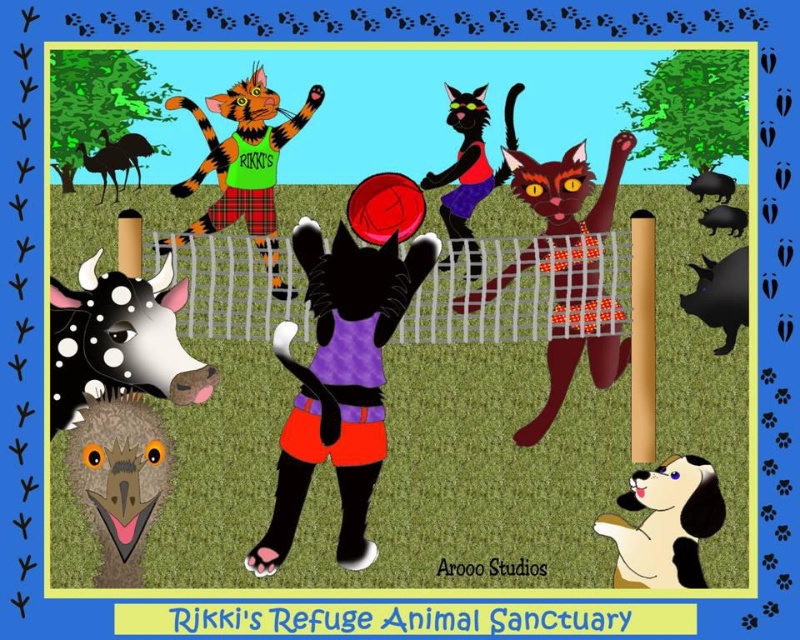
Between brown fuzzy head at lower left and black glossy pig at upper right, which one is positioned lower?

brown fuzzy head at lower left is below.

Does brown fuzzy head at lower left come behind black glossy pig at upper right?

No, it is not.

Which is behind, point (108, 428) or point (696, 193)?

The point (696, 193) is behind.

Where is `brown fuzzy head at lower left`? This screenshot has height=640, width=800. brown fuzzy head at lower left is located at coordinates (118, 480).

Who is positioned more to the right, purple fabric cat at center or black dotted cow at lower left?

purple fabric cat at center

Consider the image. Can you confirm if purple fabric cat at center is bigger than black dotted cow at lower left?

Yes, purple fabric cat at center is bigger than black dotted cow at lower left.

Which is behind, point (356, 445) or point (70, 328)?

Positioned behind is point (356, 445).

You are a GUI agent. You are given a task and a screenshot of the screen. Output one action in this format:
    pyautogui.click(x=<x>, y=<y>)
    Task: Click on the purple fabric cat at center
    The height and width of the screenshot is (640, 800).
    Given the screenshot: What is the action you would take?
    pyautogui.click(x=341, y=384)

Is black spiky hedgehog at lower right positioned behind black rubber pig at right?

No, it is not.

Based on the photo, can you confirm if black spiky hedgehog at lower right is smaller than black rubber pig at right?

Incorrect, black spiky hedgehog at lower right is not smaller in size than black rubber pig at right.

Is point (713, 305) more distant than point (702, 221)?

Yes, point (713, 305) is behind point (702, 221).

Identify the location of black spiky hedgehog at lower right. (720, 296).